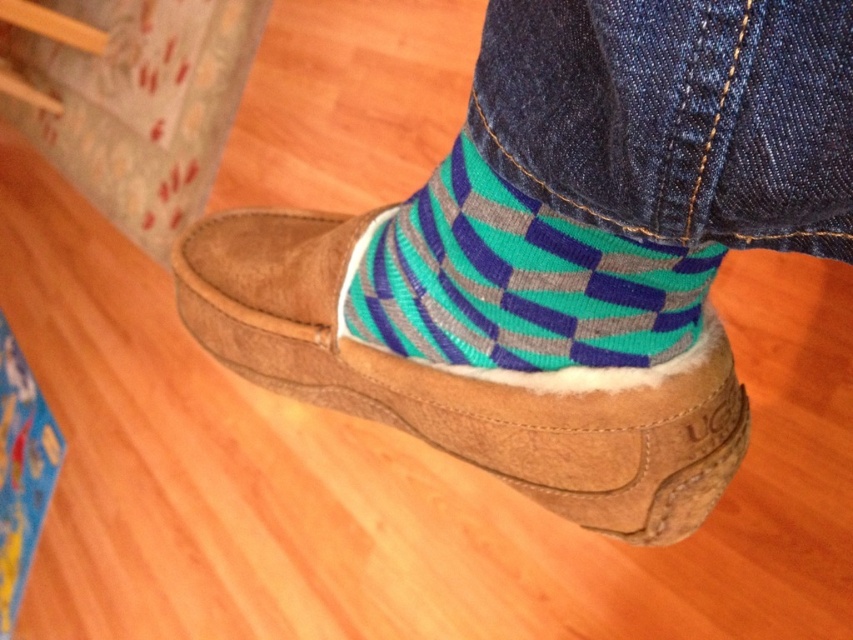
You are a fashion designer looking at the image. You need to determine the relative sizes of the dark blue denim jeans at lower center and the suede slipper at center. Which one is larger?

The suede slipper at center is larger than the dark blue denim jeans at lower center according to the description.